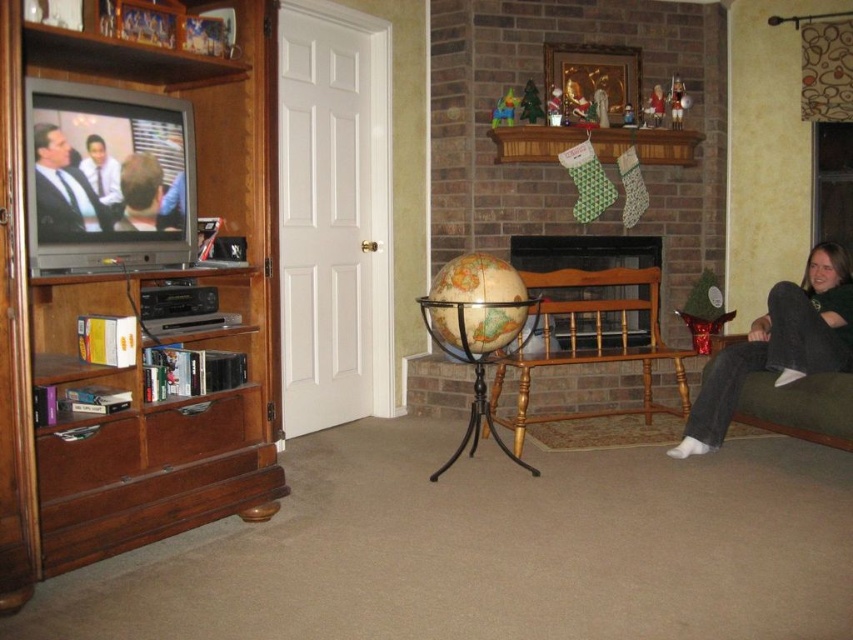
Question: Considering the real-world distances, which object is farthest from the dark gray jeans at lower right?

Choices:
 (A) brick fireplace at center
 (B) wooden bench at center

Answer: (A)

Question: Which object appears closest to the camera in this image?

Choices:
 (A) brick fireplace at center
 (B) dark gray jeans at lower right

Answer: (B)

Question: Is brown wood entertainment center at left bigger than smooth skin face at left?

Choices:
 (A) no
 (B) yes

Answer: (B)

Question: Observing the image, what is the correct spatial positioning of brick fireplace at center in reference to smooth skin face at left?

Choices:
 (A) right
 (B) left

Answer: (A)

Question: Among these points, which one is farthest from the camera?

Choices:
 (A) (96, 170)
 (B) (53, 195)
 (C) (579, 324)

Answer: (C)

Question: Can you confirm if wooden bench at center is thinner than brick fireplace at center?

Choices:
 (A) yes
 (B) no

Answer: (B)